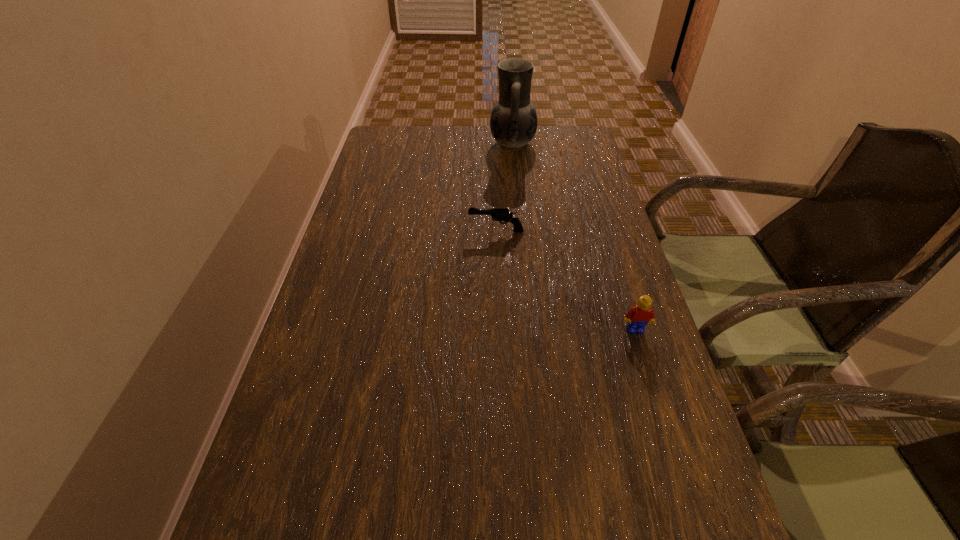
Find the location of a particular element. The width and height of the screenshot is (960, 540). vacant area between the rightmost object and the shortest object is located at coordinates (565, 280).

This screenshot has height=540, width=960. I want to click on free spot between the rightmost object and the farthest object, so click(574, 237).

Identify the location of vacant point located between the gun and the second tallest object. click(x=565, y=280).

Where is `blank region between the Lego and the tallest object`? The height and width of the screenshot is (540, 960). blank region between the Lego and the tallest object is located at coordinates (574, 237).

Where is `free space between the rightmost object and the tallest object`? free space between the rightmost object and the tallest object is located at coordinates (574, 237).

Identify which object is the second nearest to the nearest object. Please provide its 2D coordinates. Your answer should be formatted as a tuple, i.e. [(x, y)], where the tuple contains the x and y coordinates of a point satisfying the conditions above.

[(513, 123)]

This screenshot has width=960, height=540. I want to click on object that stands as the second closest to the second farthest object, so click(x=513, y=123).